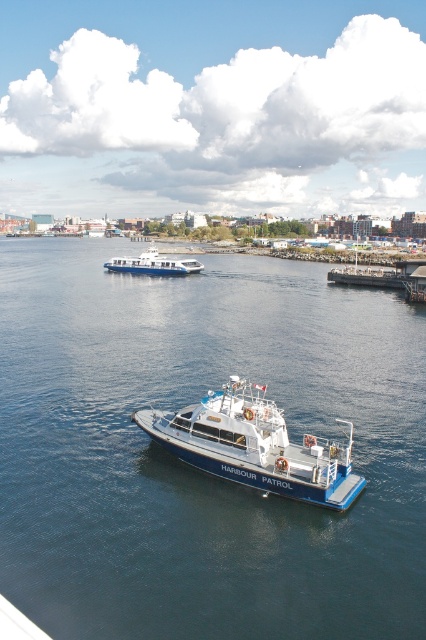
Is point (169, 490) in front of point (163, 412)?

Yes, point (169, 490) is in front of point (163, 412).

Identify the location of blue water at center. Image resolution: width=426 pixels, height=640 pixels. (192, 468).

Locate an element on the screen. blue water at center is located at coordinates (192, 468).

Consider the image. Between white glossy ferry at center and wooden dock at right, which one has less height?

white glossy ferry at center is shorter.

Does white glossy ferry at center have a greater width compared to wooden dock at right?

Indeed, white glossy ferry at center has a greater width compared to wooden dock at right.

Does point (135, 264) come farther from viewer compared to point (385, 282)?

Yes.

Identify the location of white glossy ferry at center. The width and height of the screenshot is (426, 640). (152, 264).

Does blue water at center have a greater height compared to white glossy ferry at center?

Indeed, blue water at center has a greater height compared to white glossy ferry at center.

Is blue water at center positioned behind white glossy ferry at center?

That is False.

Is point (109, 516) closer to viewer compared to point (138, 269)?

That is True.

This screenshot has height=640, width=426. Identify the location of blue water at center. (192, 468).